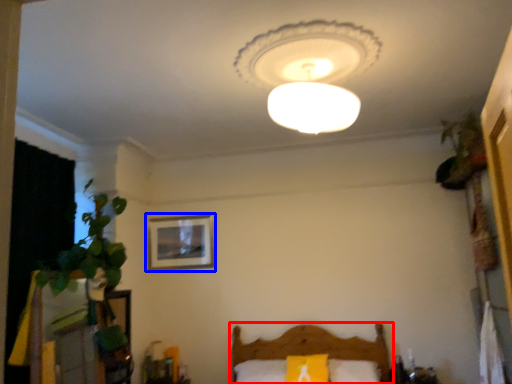
Question: Which of the following is the closest to the observer, furniture (highlighted by a red box) or picture frame (highlighted by a blue box)?

Choices:
 (A) furniture
 (B) picture frame

Answer: (A)